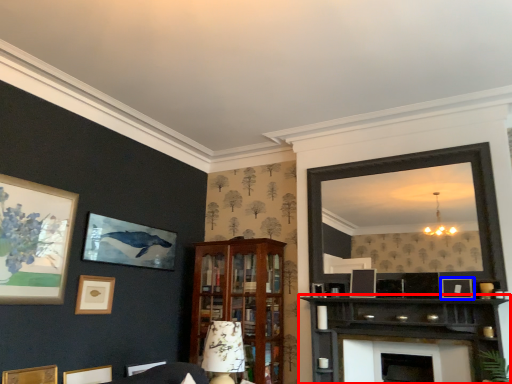
Question: Which object appears farthest to the camera in this image, shelf (highlighted by a red box) or picture frame (highlighted by a blue box)?

Choices:
 (A) shelf
 (B) picture frame

Answer: (B)